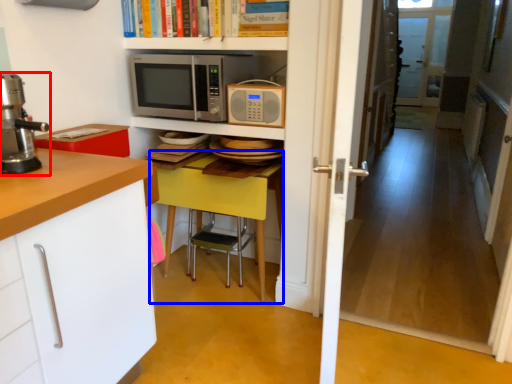
Question: Which object appears farthest to the camera in this image, home appliance (highlighted by a red box) or table (highlighted by a blue box)?

Choices:
 (A) home appliance
 (B) table

Answer: (B)